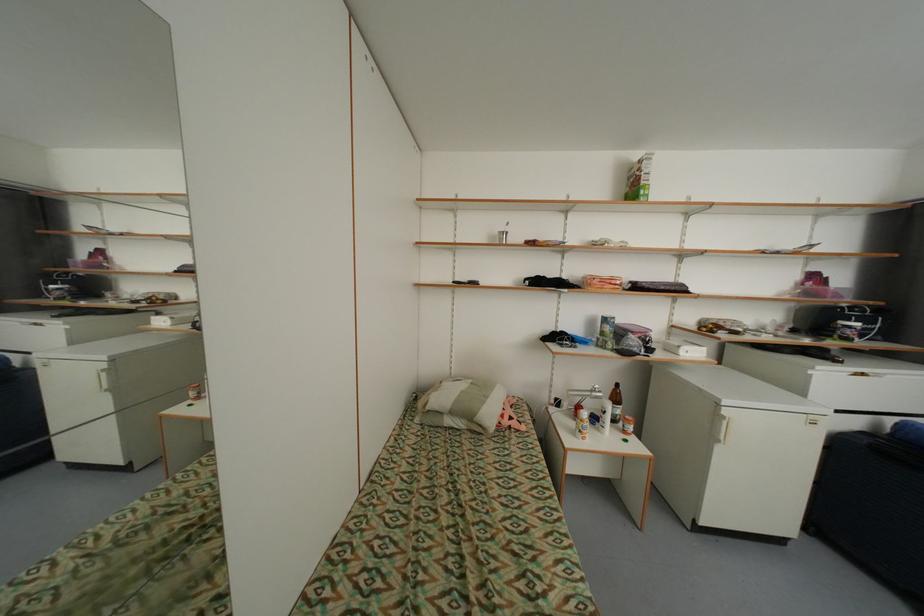
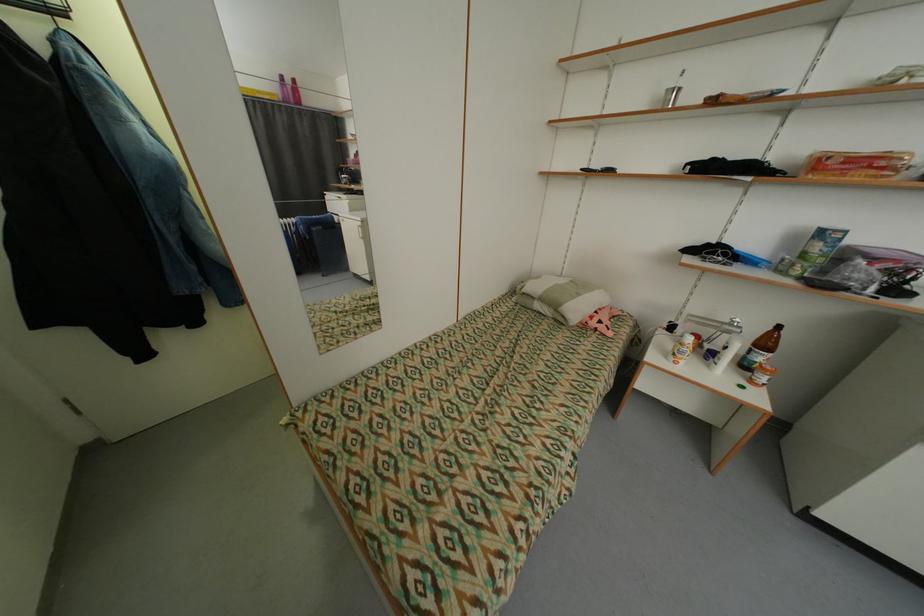
Where in the second image is the point corresponding to (x=604, y=431) from the first image?

(714, 367)